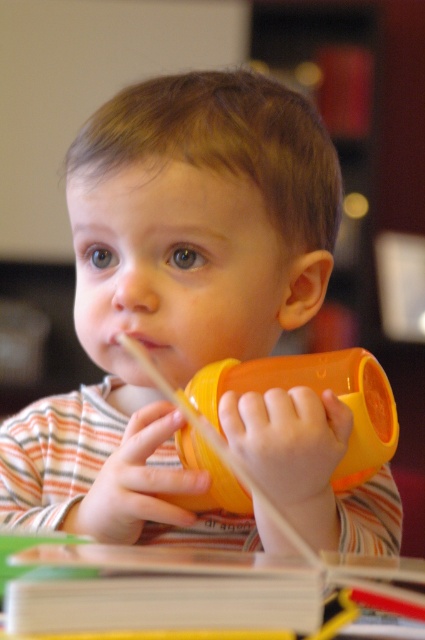
Question: Among these objects, which one is nearest to the camera?

Choices:
 (A) orange matte sippy cup at center
 (B) orange plastic cup at center

Answer: (A)

Question: Observing the image, what is the correct spatial positioning of orange plastic cup at center in reference to orange matte sippy cup at center?

Choices:
 (A) left
 (B) right

Answer: (A)

Question: Is orange plastic cup at center closer to camera compared to orange matte sippy cup at center?

Choices:
 (A) no
 (B) yes

Answer: (A)

Question: Does orange plastic cup at center appear on the left side of orange matte sippy cup at center?

Choices:
 (A) no
 (B) yes

Answer: (B)